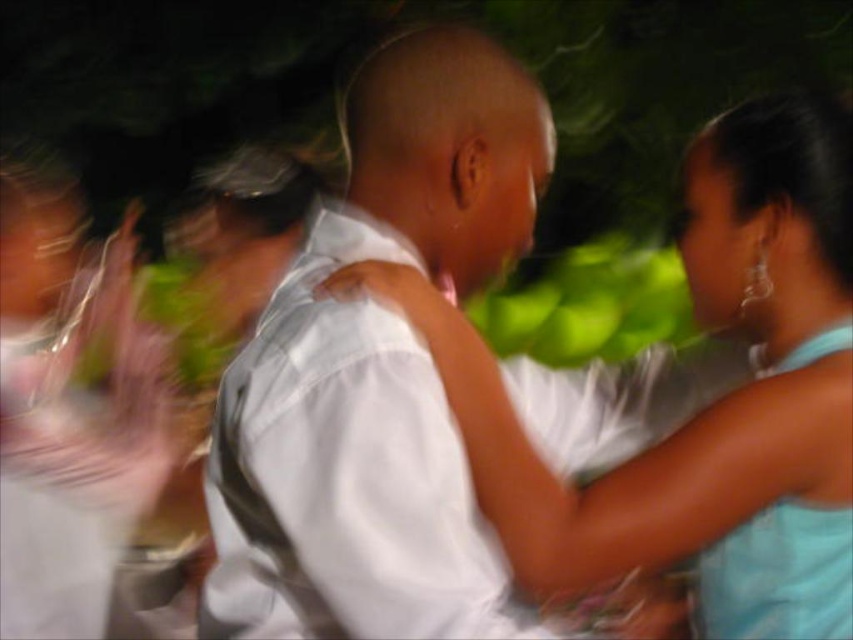
You are at a social event and see the white smooth shirt at center and the light blue satin dress at right. Which one is positioned more to the left side of the scene?

The white smooth shirt at center is positioned more to the left side of the scene than the light blue satin dress at right.

You are organizing a clothing donation drive and need to categorize items based on size. You have two items in front of you from the image described. Which of the two items, the white smooth shirt at center or the light blue satin dress at right, would you place in the large size bin?

The white smooth shirt at center is larger in size than the light blue satin dress at right, so the white smooth shirt at center should be placed in the large size bin.